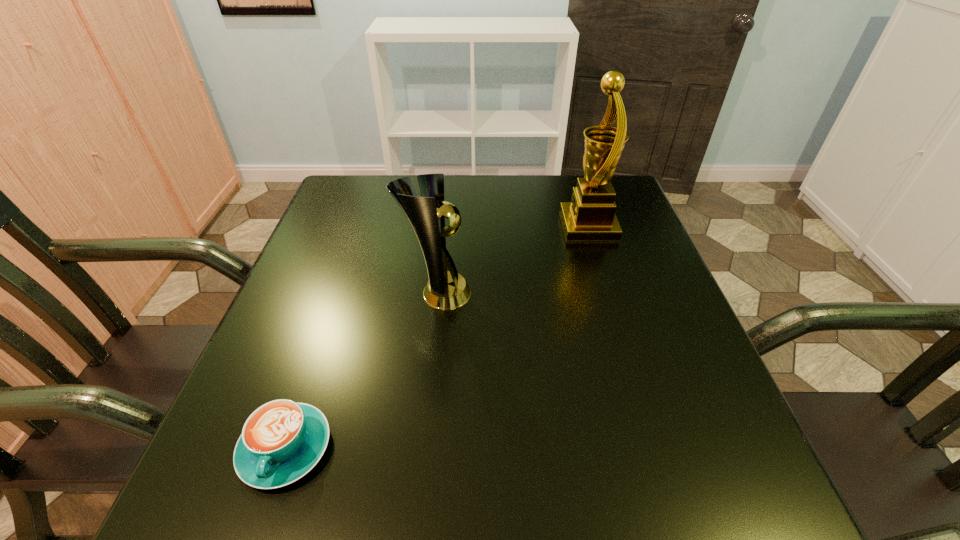
At what (x,y) coordinates should I click in order to perform the action: click on vacant region at the far right corner of the desktop. Please return your answer as a coordinate pair (x, y). Image resolution: width=960 pixels, height=540 pixels. Looking at the image, I should click on (571, 182).

The image size is (960, 540). In the image, there is a desktop. Identify the location of vacant space at the near right corner. (754, 513).

At what (x,y) coordinates should I click in order to perform the action: click on free space between the rightmost object and the leftmost object. Please return your answer as a coordinate pair (x, y). Looking at the image, I should click on (437, 337).

At what (x,y) coordinates should I click in order to perform the action: click on vacant space that's between the nearest object and the shorter award. Please return your answer as a coordinate pair (x, y). The height and width of the screenshot is (540, 960). Looking at the image, I should click on (362, 371).

Find the location of a particular element. The image size is (960, 540). free space between the rightmost object and the nearer award is located at coordinates (513, 260).

Where is `free area in between the taller award and the shortest object`? free area in between the taller award and the shortest object is located at coordinates (437, 337).

You are a GUI agent. You are given a task and a screenshot of the screen. Output one action in this format:
    pyautogui.click(x=<x>, y=<y>)
    Task: Click on the free spot between the right award and the shorter award
    The image size is (960, 540).
    Given the screenshot: What is the action you would take?
    pyautogui.click(x=513, y=260)

Identify the location of free space between the rightmost object and the shortest object. (437, 337).

Locate an element on the screen. The image size is (960, 540). vacant region between the shortest object and the second farthest object is located at coordinates tap(362, 371).

The height and width of the screenshot is (540, 960). I want to click on unoccupied area between the leftmost object and the right award, so click(437, 337).